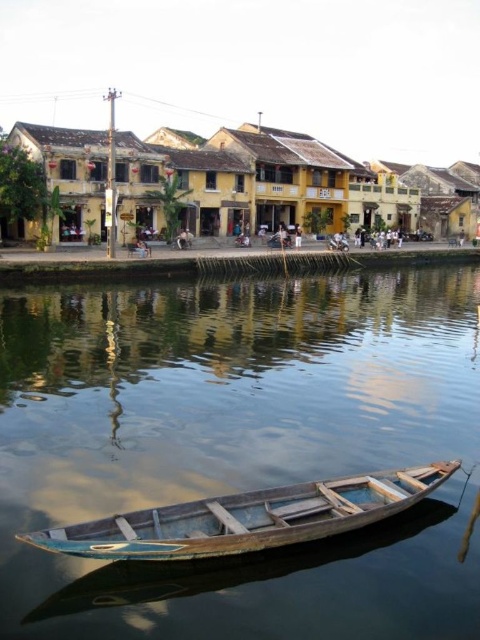
Question: Which point is closer to the camera?

Choices:
 (A) wooden boat at lower center
 (B) smooth dark blue water at center

Answer: (B)

Question: Which object is farther from the camera taking this photo?

Choices:
 (A) smooth dark blue water at center
 (B) wooden boat at lower center

Answer: (B)

Question: Does smooth dark blue water at center have a lesser width compared to wooden boat at lower center?

Choices:
 (A) no
 (B) yes

Answer: (A)

Question: Which object is farther from the camera taking this photo?

Choices:
 (A) smooth dark blue water at center
 (B) wooden boat at lower center

Answer: (B)

Question: Is smooth dark blue water at center positioned before wooden boat at lower center?

Choices:
 (A) yes
 (B) no

Answer: (A)

Question: Is the position of smooth dark blue water at center more distant than that of wooden boat at lower center?

Choices:
 (A) yes
 (B) no

Answer: (B)